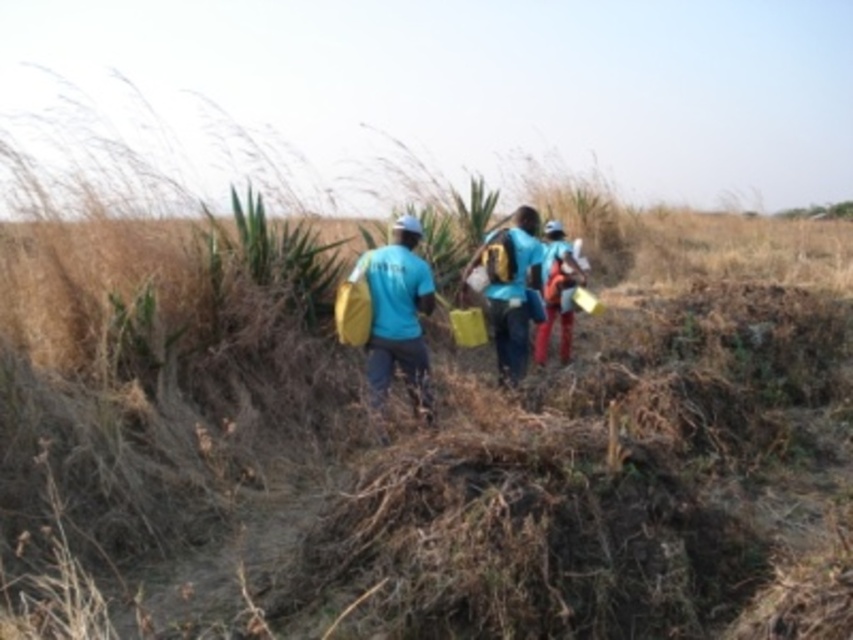
Looking at this image, you are a photographer trying to capture the group in the field. You notice the matte blue shirt at center and the matte orange backpack at center. Which object should you focus on if you want to capture the one that is more to the right?

The matte orange backpack at center is more to the right because the matte blue shirt at center is positioned on its left side.

You are a member of the group in the image and need to place a marker at point (399, 316). Where should you place it?

The point (399, 316) is on the matte blue shirt at center, so place the marker on the matte blue shirt at center.

You are a member of the group walking through the field. You need to hand over a sample from your blue matte backpack at center to the person carrying the matte orange backpack at center. Which direction should you move to reach them?

The blue matte backpack at center is to the left of the matte orange backpack at center. To reach the person with the matte orange backpack at center, you should move to your right.